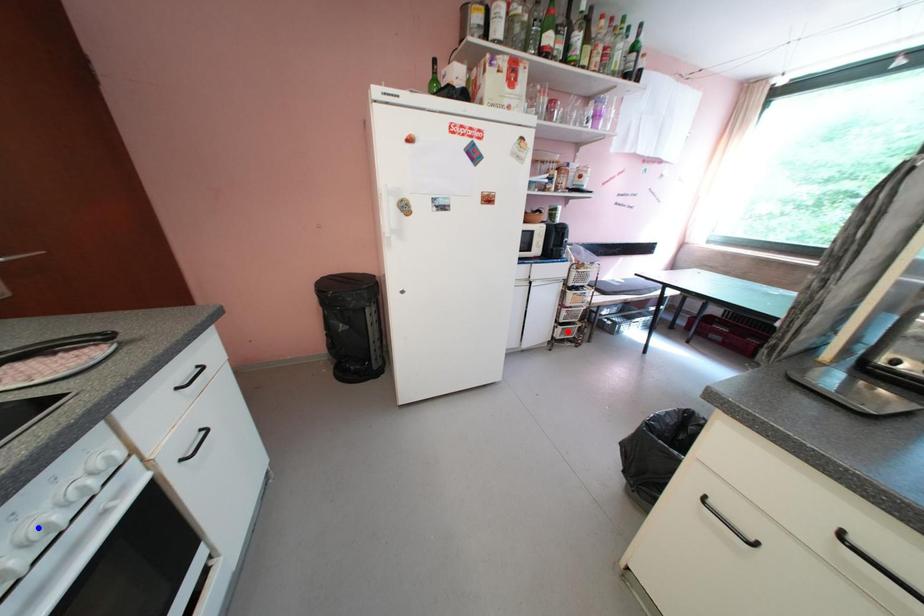
Question: Two points are marked on the image. Which point is closer to the camera?

Choices:
 (A) Blue point is closer.
 (B) Red point is closer.

Answer: (A)